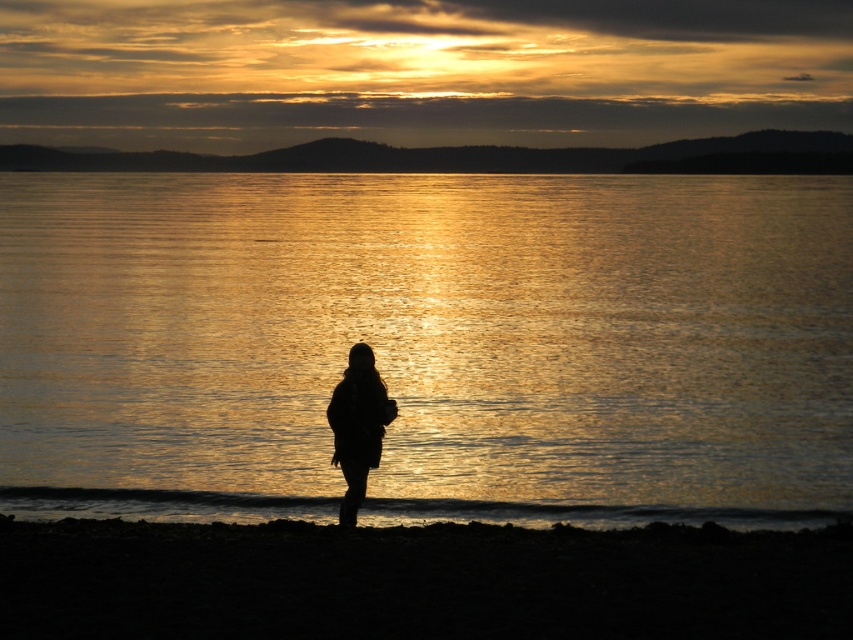
Does glistening reflective water at center have a smaller size compared to silhouette fabric at center?

Incorrect, glistening reflective water at center is not smaller in size than silhouette fabric at center.

Describe the element at coordinates (428, 344) in the screenshot. I see `glistening reflective water at center` at that location.

At what (x,y) coordinates should I click in order to perform the action: click on glistening reflective water at center. Please return your answer as a coordinate pair (x, y). This screenshot has width=853, height=640. Looking at the image, I should click on (428, 344).

Can you confirm if glistening reflective water at center is shorter than silvery reflective water at upper center?

No.

Can you confirm if glistening reflective water at center is smaller than silvery reflective water at upper center?

Incorrect, glistening reflective water at center is not smaller in size than silvery reflective water at upper center.

Does point (666, 412) lie behind point (822, 147)?

No, it is in front of (822, 147).

Where is `glistening reflective water at center`? glistening reflective water at center is located at coordinates (428, 344).

Which is behind, point (109, 156) or point (355, 387)?

Point (109, 156)

Who is more forward, [438,156] or [355,378]?

Point [355,378]

This screenshot has width=853, height=640. What are the coordinates of `silvery reflective water at upper center` in the screenshot? It's located at (474, 157).